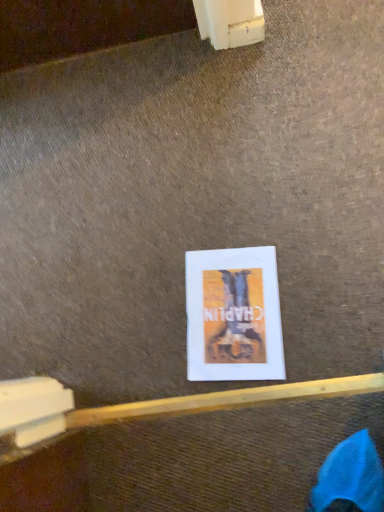
Locate an element on the screen. Image resolution: width=384 pixels, height=512 pixels. empty space that is ontop of white paper at center (from a real-world perspective) is located at coordinates (230, 311).